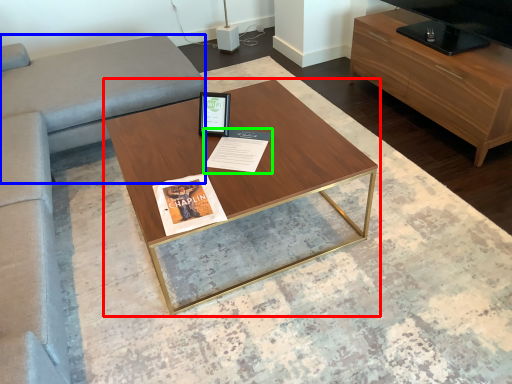
Question: Estimate the real-world distances between objects in this image. Which object is closer to coffee table (highlighted by a red box), gray (highlighted by a blue box) or magazine (highlighted by a green box)?

Choices:
 (A) gray
 (B) magazine

Answer: (B)